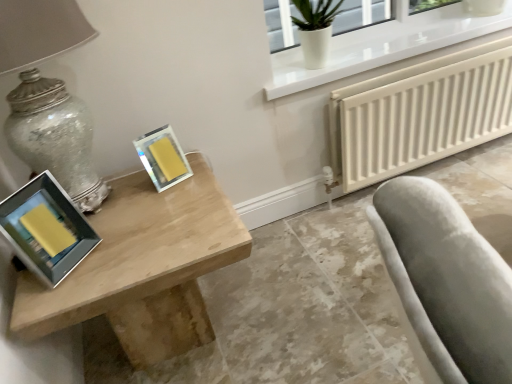
In order to click on vacant space to the left of yellow matte picture frame at upper center, which is the second picture frame from left to right in this screenshot , I will do `click(119, 191)`.